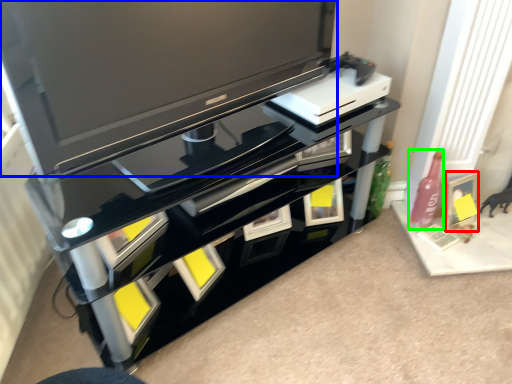
Question: Considering the real-world distances, which object is farthest from picture frame (highlighted by a red box)? television (highlighted by a blue box) or bottle (highlighted by a green box)?

Choices:
 (A) television
 (B) bottle

Answer: (A)